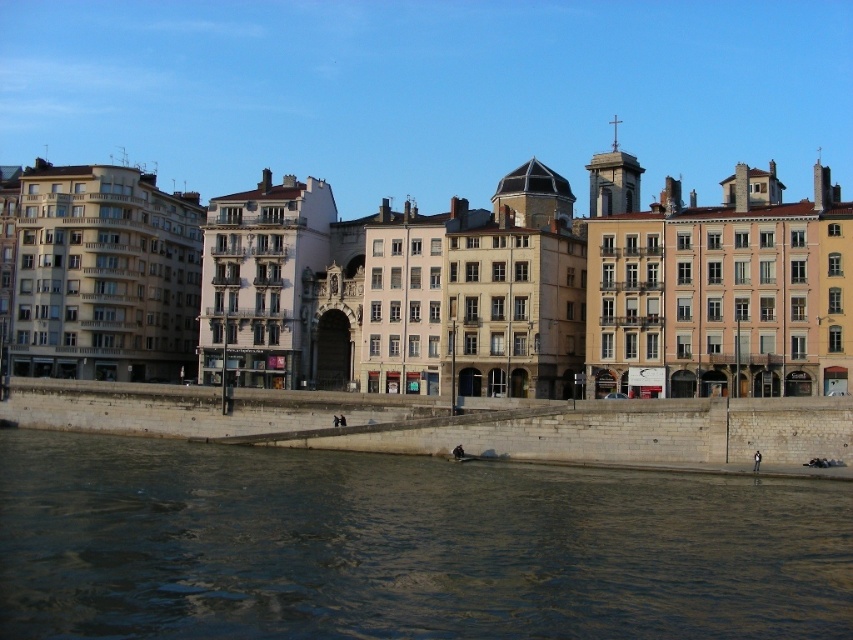
Is point (115, 548) closer to camera compared to point (213, 412)?

That is True.

Which is in front, point (332, 627) or point (527, 449)?

Point (332, 627) is in front.

This screenshot has height=640, width=853. I want to click on dark water at lower center, so click(403, 547).